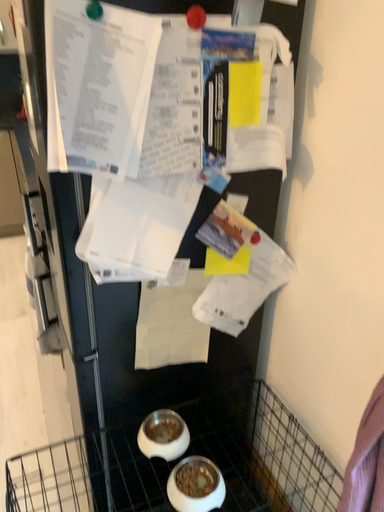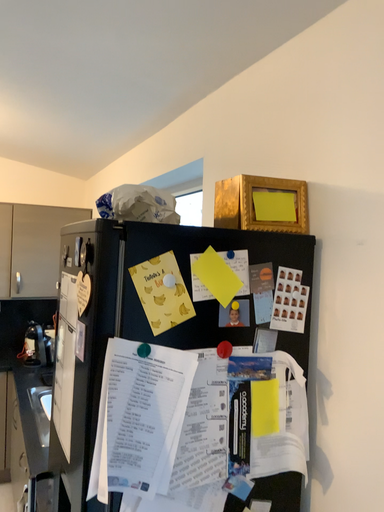
Question: How did the camera likely rotate when shooting the video?

Choices:
 (A) rotated downward
 (B) rotated upward

Answer: (B)